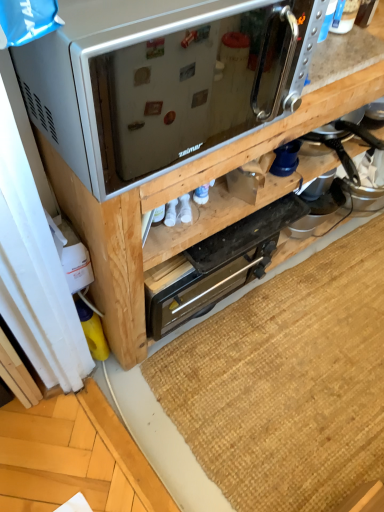
Question: Is black metallic toaster oven at center spatially inside satin silver microwave at upper center, or outside of it?

Choices:
 (A) outside
 (B) inside

Answer: (A)

Question: From a real-world perspective, relative to satin silver microwave at upper center, is black metallic toaster oven at center vertically above or below?

Choices:
 (A) below
 (B) above

Answer: (A)

Question: Based on their relative distances, which object is farther from the brown woven mat at lower center?

Choices:
 (A) metallic silver toaster oven at upper center
 (B) satin silver microwave at upper center
 (C) black metallic toaster oven at center

Answer: (B)

Question: Which is nearer to the black metallic toaster oven at center?

Choices:
 (A) brown woven mat at lower center
 (B) metallic silver toaster oven at upper center
 (C) satin silver microwave at upper center

Answer: (B)